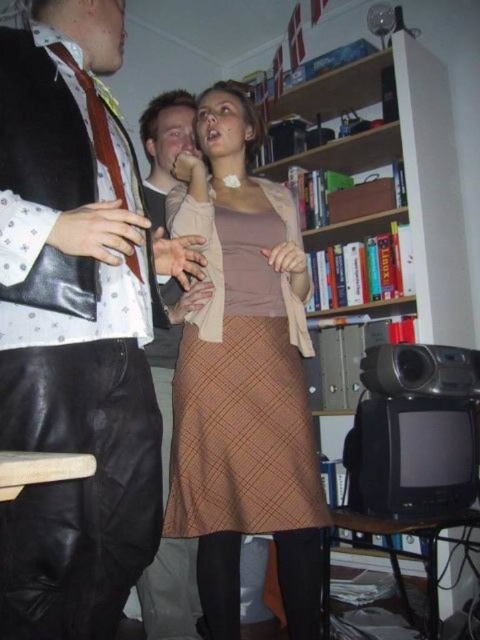
Question: Which object is the closest to the leather pants at center?

Choices:
 (A) wooden bookshelf at center
 (B) matte black tie at center

Answer: (B)

Question: Which object appears closest to the camera in this image?

Choices:
 (A) matte black tie at center
 (B) brown plaid skirt at center
 (C) leather pants at center

Answer: (C)

Question: Estimate the real-world distances between objects in this image. Which object is closer to the wooden bookshelf at center?

Choices:
 (A) leather pants at center
 (B) matte black tie at center

Answer: (B)

Question: Where is wooden bookshelf at center located in relation to matte black tie at center in the image?

Choices:
 (A) left
 (B) right

Answer: (B)

Question: Does brown plaid skirt at center appear under matte black tie at center?

Choices:
 (A) yes
 (B) no

Answer: (B)

Question: Is brown plaid skirt at center bigger than matte black tie at center?

Choices:
 (A) no
 (B) yes

Answer: (A)